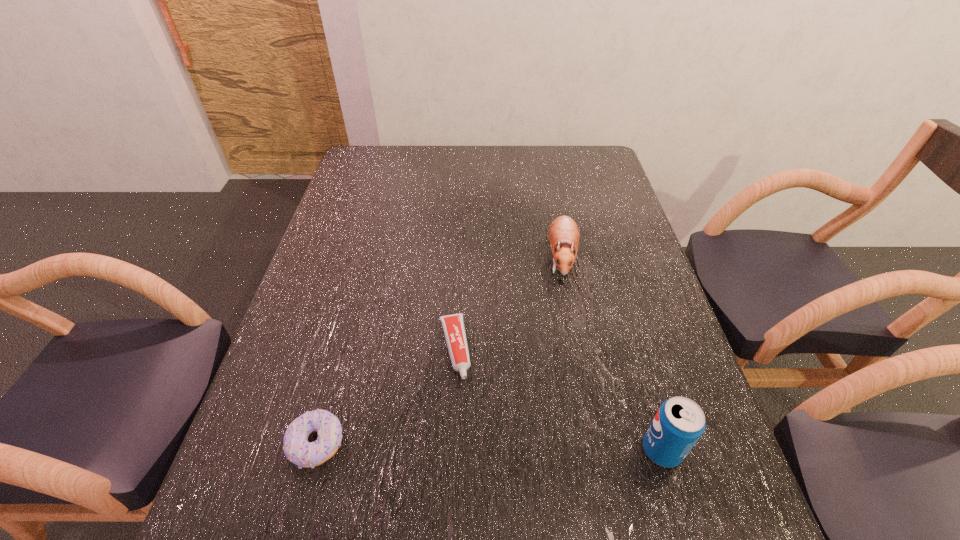
You are a GUI agent. You are given a task and a screenshot of the screen. Output one action in this format:
    pyautogui.click(x=<x>, y=<y>)
    Task: Click on the object that is at the near left corner
    
    Given the screenshot: What is the action you would take?
    (x=297, y=449)

Where is `object at the near right corner`? The width and height of the screenshot is (960, 540). object at the near right corner is located at coordinates 679,423.

Find the location of a particular element. free point at the far edge is located at coordinates (477, 146).

At what (x,y) coordinates should I click in order to perform the action: click on free point at the near edge. Please return your answer as a coordinate pair (x, y). Image resolution: width=960 pixels, height=540 pixels. Looking at the image, I should click on (331, 486).

Find the location of a particular element. This screenshot has width=960, height=540. vacant space at the left edge is located at coordinates (355, 267).

Find the location of `free location at the right edge`. free location at the right edge is located at coordinates (591, 187).

You are a GUI agent. You are given a task and a screenshot of the screen. Output one action in this format:
    pyautogui.click(x=<x>, y=<y>)
    Task: Click on the vacant area at the far right corner of the desktop
    The image size is (960, 540).
    Given the screenshot: What is the action you would take?
    pyautogui.click(x=599, y=150)

I want to click on free space between the hamster and the tallest object, so click(x=612, y=354).

Locate an element on the screen. vacant region between the tallest object and the shortest object is located at coordinates (558, 399).

Locate an element on the screen. Image resolution: width=960 pixels, height=540 pixels. vacant space in between the tallest object and the toothpaste is located at coordinates (558, 399).